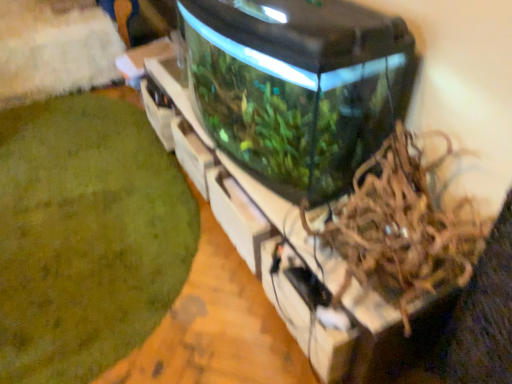
Question: In the image, is transparent glass water tank at center on the left side or the right side of green moss at lower left?

Choices:
 (A) left
 (B) right

Answer: (B)

Question: Is point [245, 120] closer or farther from the camera than point [31, 283]?

Choices:
 (A) closer
 (B) farther

Answer: (A)

Question: Estimate the real-world distances between objects in this image. Which object is closer to the brown shredded paper at center-right?

Choices:
 (A) transparent glass water tank at center
 (B) green moss at lower left

Answer: (A)

Question: Based on their relative distances, which object is farther from the brown shredded paper at center-right?

Choices:
 (A) green moss at lower left
 (B) transparent glass water tank at center

Answer: (A)